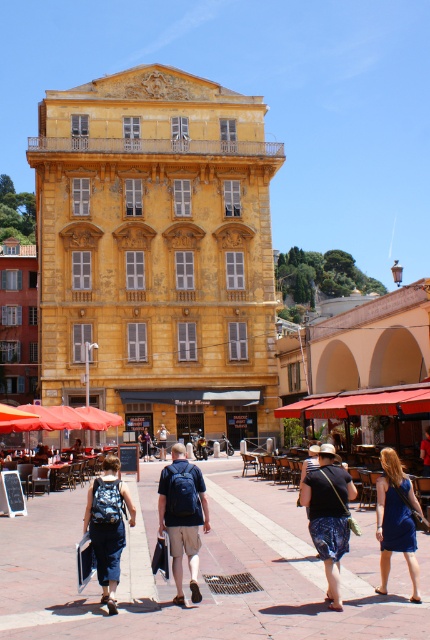
You are standing at the point marked as point (202, 572) in the image. Based on the scene description, what is the surface you are standing on?

The point (202, 572) corresponds to the brick paved square at center, so you are standing on a brick paved surface.

You are standing in the middle of the street looking at the historic yellow building. There are two points marked on the building facade. The first point is at coordinates point (203,548) and the second is at point (411,502). Which point is closer to you?

Point (203,548) is closer to you because it is further to the viewer than point (411,502).

You are a delivery person standing at the entrance of the grand yellow building and need to place a blue fabric backpack at center. Where exactly should you place it?

Place the blue fabric backpack at center at the coordinates point (x=183, y=518).